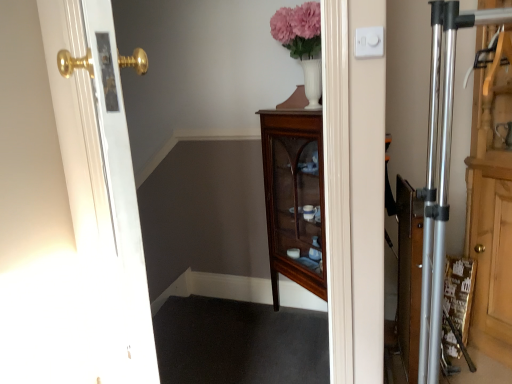
Question: Does mahogany glass-front cabinet at center have a smaller size compared to white glossy door at left?

Choices:
 (A) yes
 (B) no

Answer: (B)

Question: Can you see mahogany glass-front cabinet at center touching white glossy door at left?

Choices:
 (A) no
 (B) yes

Answer: (A)

Question: From a real-world perspective, is mahogany glass-front cabinet at center under white glossy door at left?

Choices:
 (A) no
 (B) yes

Answer: (B)

Question: Is mahogany glass-front cabinet at center not near white glossy door at left?

Choices:
 (A) no
 (B) yes

Answer: (B)

Question: Considering the relative sizes of mahogany glass-front cabinet at center and white glossy door at left in the image provided, is mahogany glass-front cabinet at center shorter than white glossy door at left?

Choices:
 (A) yes
 (B) no

Answer: (A)

Question: Considering the relative positions of white plastic/light switch at upper right and white glossy door at left in the image provided, is white plastic/light switch at upper right to the left or to the right of white glossy door at left?

Choices:
 (A) left
 (B) right

Answer: (B)

Question: Is point (372, 41) closer or farther from the camera than point (80, 21)?

Choices:
 (A) closer
 (B) farther

Answer: (A)

Question: Considering their positions, is white plastic/light switch at upper right located in front of or behind white glossy door at left?

Choices:
 (A) behind
 (B) front

Answer: (A)

Question: Is white plastic/light switch at upper right bigger or smaller than white glossy door at left?

Choices:
 (A) small
 (B) big

Answer: (A)

Question: In terms of width, does white glossy door at left look wider or thinner when compared to mahogany glass-front cabinet at center?

Choices:
 (A) wide
 (B) thin

Answer: (B)

Question: Is point (83, 51) closer or farther from the camera than point (298, 137)?

Choices:
 (A) farther
 (B) closer

Answer: (B)

Question: Is white glossy door at left inside the boundaries of mahogany glass-front cabinet at center, or outside?

Choices:
 (A) inside
 (B) outside

Answer: (B)

Question: Considering the relative positions of white glossy door at left and mahogany glass-front cabinet at center in the image provided, is white glossy door at left to the left or to the right of mahogany glass-front cabinet at center?

Choices:
 (A) right
 (B) left

Answer: (B)

Question: In terms of height, does wooden dresser at right look taller or shorter compared to mahogany glass-front cabinet at center?

Choices:
 (A) tall
 (B) short

Answer: (A)

Question: Is point (475, 203) closer or farther from the camera than point (297, 248)?

Choices:
 (A) closer
 (B) farther

Answer: (A)